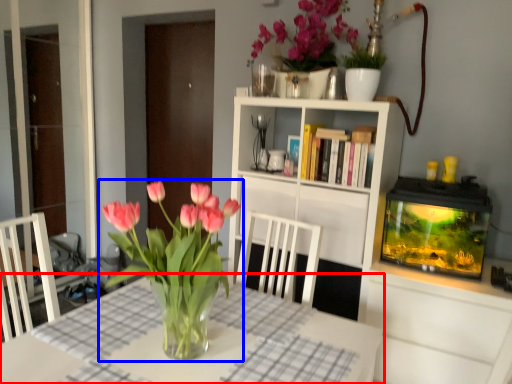
Question: Which point is closer to the camera, table (highlighted by a red box) or houseplant (highlighted by a blue box)?

Choices:
 (A) table
 (B) houseplant

Answer: (A)